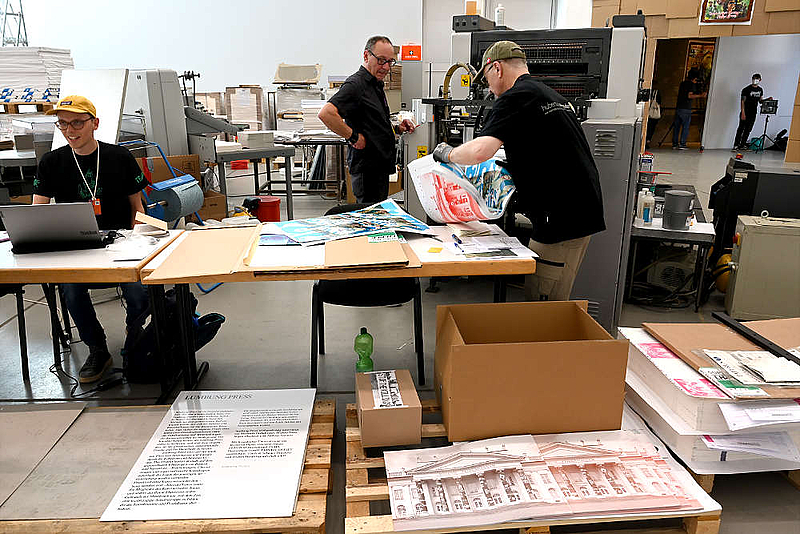
Find the location of a particular element. This screenshot has height=534, width=800. wall is located at coordinates (253, 33), (734, 53), (101, 21).